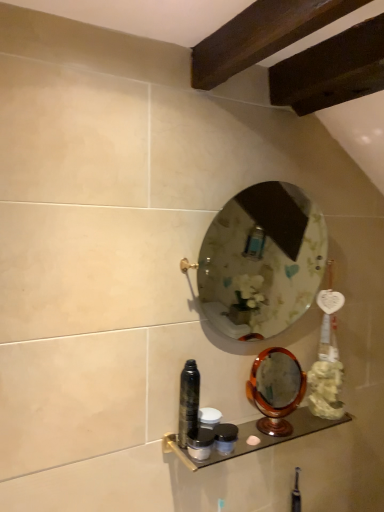
Measure the distance between point [216,431] and camera.

1.14 meters.

Describe the element at coordinates (225, 437) in the screenshot. This screenshot has width=384, height=512. I see `matte black container at lower center, placed as the first toiletry when sorted from bottom to top` at that location.

What are the coordinates of `matte black container at lower center, which is counted as the 2th toiletry, starting from the top` in the screenshot? It's located at (209, 417).

Describe the element at coordinates (188, 402) in the screenshot. Image resolution: width=384 pixels, height=512 pixels. I see `shiny black can at center, positioned as the first toiletry in top-to-bottom order` at that location.

What is the approximate height of clear glass mirror at center, positioned as the 2th mirror in bottom-to-top order?

clear glass mirror at center, positioned as the 2th mirror in bottom-to-top order, is 20.43 inches tall.

At what (x,y) coordinates should I click in order to perform the action: click on wooden polished mirror at lower right, positioned as the 1th mirror in bottom-to-top order. Please return your answer as a coordinate pair (x, y). The image size is (384, 512). Looking at the image, I should click on (276, 389).

Find the location of a particular element. This screenshot has width=384, height=512. metallic glass shelf at lower center is located at coordinates (254, 435).

Is clear glass mirror at center, positioned as the 2th mirror in bottom-to-top order, bigger or smaller than matte black container at lower center, which is counted as the 2th toiletry, starting from the top?

clear glass mirror at center, positioned as the 2th mirror in bottom-to-top order, is bigger than matte black container at lower center, which is counted as the 2th toiletry, starting from the top.

In the scene shown: How different are the orientations of clear glass mirror at center, positioned as the 2th mirror in bottom-to-top order, and matte black container at lower center, which is counted as the 2th toiletry, starting from the top, in degrees?

The angle between the facing direction of clear glass mirror at center, positioned as the 2th mirror in bottom-to-top order, and the facing direction of matte black container at lower center, which is counted as the 2th toiletry, starting from the top, is 0.848 degrees.

In terms of width, does clear glass mirror at center, positioned as the 2th mirror in bottom-to-top order, look wider or thinner when compared to matte black container at lower center, the 3th toiletry when ordered from bottom to top?

Considering their sizes, clear glass mirror at center, positioned as the 2th mirror in bottom-to-top order, looks broader than matte black container at lower center, the 3th toiletry when ordered from bottom to top.

Consider the image. From the image's perspective, which is below, clear glass mirror at center, positioned as the 2th mirror in bottom-to-top order, or matte black container at lower center, which is counted as the 2th toiletry, starting from the top?

From the image's view, matte black container at lower center, which is counted as the 2th toiletry, starting from the top, is below.

Is clear glass mirror at center, positioned as the 2th mirror in bottom-to-top order, beside shiny black can at center, positioned as the first toiletry in top-to-bottom order?

No, clear glass mirror at center, positioned as the 2th mirror in bottom-to-top order, is not touching shiny black can at center, positioned as the first toiletry in top-to-bottom order.

Considering the positions of objects clear glass mirror at center, positioned as the 2th mirror in bottom-to-top order, and shiny black can at center, positioned as the first toiletry in top-to-bottom order, in the image provided, who is behind, clear glass mirror at center, positioned as the 2th mirror in bottom-to-top order, or shiny black can at center, positioned as the first toiletry in top-to-bottom order,?

shiny black can at center, positioned as the first toiletry in top-to-bottom order, is behind.

Is matte black container at lower center, the 3th toiletry when ordered from bottom to top, to the left or to the right of metallic glass shelf at lower center in the image?

From the image, it's evident that matte black container at lower center, the 3th toiletry when ordered from bottom to top, is to the left of metallic glass shelf at lower center.

Considering the positions of objects matte black container at lower center, the 3th toiletry when ordered from bottom to top, and metallic glass shelf at lower center in the image provided, who is behind, matte black container at lower center, the 3th toiletry when ordered from bottom to top, or metallic glass shelf at lower center?

matte black container at lower center, the 3th toiletry when ordered from bottom to top.

Could you measure the distance between matte black container at lower center, the 3th toiletry when ordered from bottom to top, and metallic glass shelf at lower center?

They are 8.04 inches apart.

Does matte black container at lower center, the 3th toiletry when ordered from bottom to top, have a lesser height compared to clear glass mirror at center, acting as the 1th mirror starting from the top?

Indeed, matte black container at lower center, the 3th toiletry when ordered from bottom to top, has a lesser height compared to clear glass mirror at center, acting as the 1th mirror starting from the top.

Does matte black container at lower center, the 3th toiletry when ordered from bottom to top, have a smaller size compared to clear glass mirror at center, positioned as the 2th mirror in bottom-to-top order?

Correct, matte black container at lower center, the 3th toiletry when ordered from bottom to top, occupies less space than clear glass mirror at center, positioned as the 2th mirror in bottom-to-top order.

Is matte black container at lower center, the 3th toiletry when ordered from bottom to top, placed right next to clear glass mirror at center, positioned as the 2th mirror in bottom-to-top order?

matte black container at lower center, the 3th toiletry when ordered from bottom to top, is not next to clear glass mirror at center, positioned as the 2th mirror in bottom-to-top order, and they're not touching.

Is matte black container at lower center, which is counted as the 2th toiletry, starting from the top, wider than clear glass mirror at center, positioned as the 2th mirror in bottom-to-top order?

No, matte black container at lower center, which is counted as the 2th toiletry, starting from the top, is not wider than clear glass mirror at center, positioned as the 2th mirror in bottom-to-top order.

From the picture: From the image's perspective, is shiny black can at center, positioned as the first toiletry in top-to-bottom order, positioned above or below matte black container at center, acting as the 2th toiletry starting from the bottom?

shiny black can at center, positioned as the first toiletry in top-to-bottom order, is situated higher than matte black container at center, acting as the 2th toiletry starting from the bottom, in the image.

From a real-world perspective, is shiny black can at center, positioned as the first toiletry in top-to-bottom order, on matte black container at center, the 3th toiletry from the top?

Yes, from a real-world perspective, shiny black can at center, positioned as the first toiletry in top-to-bottom order, is on top of matte black container at center, the 3th toiletry from the top.

Visually, is shiny black can at center, the 4th toiletry when ordered from bottom to top, positioned to the left or to the right of matte black container at center, acting as the 2th toiletry starting from the bottom?

In the image, shiny black can at center, the 4th toiletry when ordered from bottom to top, appears on the left side of matte black container at center, acting as the 2th toiletry starting from the bottom.

Considering the relative sizes of matte black container at center, acting as the 2th toiletry starting from the bottom, and matte black container at lower center, which is the fourth toiletry from top to bottom, in the image provided, is matte black container at center, acting as the 2th toiletry starting from the bottom, bigger than matte black container at lower center, which is the fourth toiletry from top to bottom,?

Indeed, matte black container at center, acting as the 2th toiletry starting from the bottom, has a larger size compared to matte black container at lower center, which is the fourth toiletry from top to bottom.

From the image's perspective, which is below, matte black container at center, acting as the 2th toiletry starting from the bottom, or matte black container at lower center, placed as the first toiletry when sorted from bottom to top?

matte black container at lower center, placed as the first toiletry when sorted from bottom to top.

Is matte black container at center, the 3th toiletry from the top, facing towards matte black container at lower center, placed as the first toiletry when sorted from bottom to top?

No, matte black container at center, the 3th toiletry from the top, is not turned towards matte black container at lower center, placed as the first toiletry when sorted from bottom to top.

At what (x,y) coordinates should I click in order to perform the action: click on the 2nd toiletry in front of the matte black container at lower center, placed as the first toiletry when sorted from bottom to top, starting your count from the anchor. Please return your answer as a coordinate pair (x, y). Looking at the image, I should click on (200, 443).

Are shiny black can at center, the 4th toiletry when ordered from bottom to top, and metallic glass shelf at lower center far apart?

No, shiny black can at center, the 4th toiletry when ordered from bottom to top, is not far from metallic glass shelf at lower center.

Is shiny black can at center, positioned as the first toiletry in top-to-bottom order, turned away from metallic glass shelf at lower center?

No, metallic glass shelf at lower center is not at the back of shiny black can at center, positioned as the first toiletry in top-to-bottom order.

In terms of height, does shiny black can at center, the 4th toiletry when ordered from bottom to top, look taller or shorter compared to metallic glass shelf at lower center?

Clearly, shiny black can at center, the 4th toiletry when ordered from bottom to top, is taller compared to metallic glass shelf at lower center.

Between shiny black can at center, the 4th toiletry when ordered from bottom to top, and metallic glass shelf at lower center, which one has smaller width?

With smaller width is shiny black can at center, the 4th toiletry when ordered from bottom to top.

Where is `mirror located in front of the matte black container at lower center, the 3th toiletry when ordered from bottom to top`? Image resolution: width=384 pixels, height=512 pixels. mirror located in front of the matte black container at lower center, the 3th toiletry when ordered from bottom to top is located at coordinates (262, 261).

You are a GUI agent. You are given a task and a screenshot of the screen. Output one action in this format:
    pyautogui.click(x=<x>, y=<y>)
    Task: Click on the mirror lying above the shiny black can at center, the 4th toiletry when ordered from bottom to top (from the image's perspective)
    
    Given the screenshot: What is the action you would take?
    pyautogui.click(x=262, y=261)

From the picture: When comparing their distances from shiny black can at center, positioned as the first toiletry in top-to-bottom order, does metallic glass shelf at lower center or clear glass mirror at center, positioned as the 2th mirror in bottom-to-top order, seem closer?

The object closer to shiny black can at center, positioned as the first toiletry in top-to-bottom order, is metallic glass shelf at lower center.

From the picture: From the image, which object appears to be farther from clear glass mirror at center, positioned as the 2th mirror in bottom-to-top order, metallic glass shelf at lower center or matte black container at lower center, the 3th toiletry when ordered from bottom to top?

matte black container at lower center, the 3th toiletry when ordered from bottom to top, is positioned further to the anchor clear glass mirror at center, positioned as the 2th mirror in bottom-to-top order.

Which object lies further to the anchor point matte black container at center, the 3th toiletry from the top, clear glass mirror at center, acting as the 1th mirror starting from the top, or matte black container at lower center, the 3th toiletry when ordered from bottom to top?

clear glass mirror at center, acting as the 1th mirror starting from the top.

Considering their positions, is matte black container at lower center, which is the fourth toiletry from top to bottom, positioned further to shiny black can at center, positioned as the first toiletry in top-to-bottom order, than matte black container at center, the 3th toiletry from the top?

The object further to shiny black can at center, positioned as the first toiletry in top-to-bottom order, is matte black container at lower center, which is the fourth toiletry from top to bottom.

Based on their spatial positions, is metallic glass shelf at lower center or matte black container at center, acting as the 2th toiletry starting from the bottom, further from matte black container at lower center, placed as the first toiletry when sorted from bottom to top?

The object further to matte black container at lower center, placed as the first toiletry when sorted from bottom to top, is metallic glass shelf at lower center.

From the image, which object appears to be farther from wooden polished mirror at lower right, positioned as the 1th mirror in bottom-to-top order, matte black container at lower center, which is the fourth toiletry from top to bottom, or metallic glass shelf at lower center?

Among the two, matte black container at lower center, which is the fourth toiletry from top to bottom, is located further to wooden polished mirror at lower right, positioned as the 1th mirror in bottom-to-top order.

Looking at the image, which one is located closer to matte black container at center, the 3th toiletry from the top, matte black container at lower center, which is counted as the 2th toiletry, starting from the top, or shiny black can at center, positioned as the first toiletry in top-to-bottom order?

Based on the image, shiny black can at center, positioned as the first toiletry in top-to-bottom order, appears to be nearer to matte black container at center, the 3th toiletry from the top.

Estimate the real-world distances between objects in this image. Which object is closer to clear glass mirror at center, positioned as the 2th mirror in bottom-to-top order, shiny black can at center, the 4th toiletry when ordered from bottom to top, or metallic glass shelf at lower center?

metallic glass shelf at lower center lies closer to clear glass mirror at center, positioned as the 2th mirror in bottom-to-top order, than the other object.

You are a GUI agent. You are given a task and a screenshot of the screen. Output one action in this format:
    pyautogui.click(x=<x>, y=<y>)
    Task: Click on the mirror between clear glass mirror at center, acting as the 1th mirror starting from the top, and metallic glass shelf at lower center in the up-down direction
    The image size is (384, 512).
    Given the screenshot: What is the action you would take?
    pyautogui.click(x=276, y=389)

The image size is (384, 512). Find the location of `toiletry located between matte black container at lower center, the 3th toiletry when ordered from bottom to top, and wooden polished mirror at lower right, which is the second mirror in top-to-bottom order, in the left-right direction`. toiletry located between matte black container at lower center, the 3th toiletry when ordered from bottom to top, and wooden polished mirror at lower right, which is the second mirror in top-to-bottom order, in the left-right direction is located at coordinates (225, 437).

Locate an element on the screen. toiletry between matte black container at lower center, which is counted as the 2th toiletry, starting from the top, and metallic glass shelf at lower center from left to right is located at coordinates coord(225,437).

Find the location of a particular element. This screenshot has height=512, width=384. mirror between clear glass mirror at center, positioned as the 2th mirror in bottom-to-top order, and matte black container at lower center, which is the fourth toiletry from top to bottom, from top to bottom is located at coordinates (276, 389).